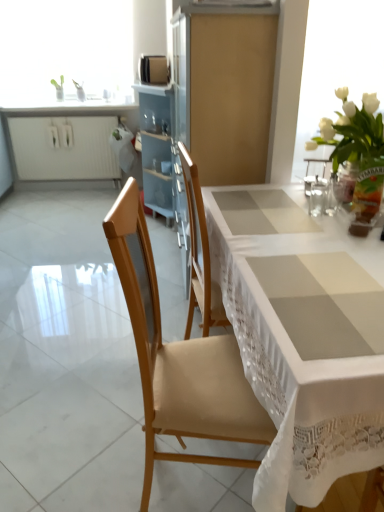
Question: Can you confirm if white lace tablecloth at center is thinner than clear glass water at upper right?

Choices:
 (A) yes
 (B) no

Answer: (B)

Question: Are white lace tablecloth at center and clear glass water at upper right far apart?

Choices:
 (A) yes
 (B) no

Answer: (B)

Question: Does white lace tablecloth at center touch clear glass water at upper right?

Choices:
 (A) yes
 (B) no

Answer: (B)

Question: Is white lace tablecloth at center smaller than clear glass water at upper right?

Choices:
 (A) no
 (B) yes

Answer: (A)

Question: Considering the relative sizes of white lace tablecloth at center and clear glass water at upper right in the image provided, is white lace tablecloth at center wider than clear glass water at upper right?

Choices:
 (A) no
 (B) yes

Answer: (B)

Question: Is satin gold microwave at upper center inside or outside of white glass vase at upper left?

Choices:
 (A) outside
 (B) inside

Answer: (A)

Question: Looking at their shapes, would you say satin gold microwave at upper center is wider or thinner than white glass vase at upper left?

Choices:
 (A) wide
 (B) thin

Answer: (B)

Question: From the image's perspective, is satin gold microwave at upper center positioned above or below white glass vase at upper left?

Choices:
 (A) above
 (B) below

Answer: (B)

Question: From their relative heights in the image, would you say satin gold microwave at upper center is taller or shorter than white glass vase at upper left?

Choices:
 (A) short
 (B) tall

Answer: (A)

Question: Considering their positions, is white glass vase at upper left located in front of or behind clear glass water at upper right?

Choices:
 (A) front
 (B) behind

Answer: (B)

Question: Does point (62, 10) appear closer or farther from the camera than point (309, 206)?

Choices:
 (A) closer
 (B) farther

Answer: (B)

Question: Considering the relative positions of white glass vase at upper left and clear glass water at upper right in the image provided, is white glass vase at upper left to the left or to the right of clear glass water at upper right?

Choices:
 (A) left
 (B) right

Answer: (A)

Question: From a real-world perspective, is white glass vase at upper left physically located above or below clear glass water at upper right?

Choices:
 (A) above
 (B) below

Answer: (A)

Question: In the image, is clear glass water at upper right positioned in front of or behind white glass vase at upper left?

Choices:
 (A) behind
 (B) front

Answer: (B)

Question: From their relative heights in the image, would you say clear glass water at upper right is taller or shorter than white glass vase at upper left?

Choices:
 (A) tall
 (B) short

Answer: (B)